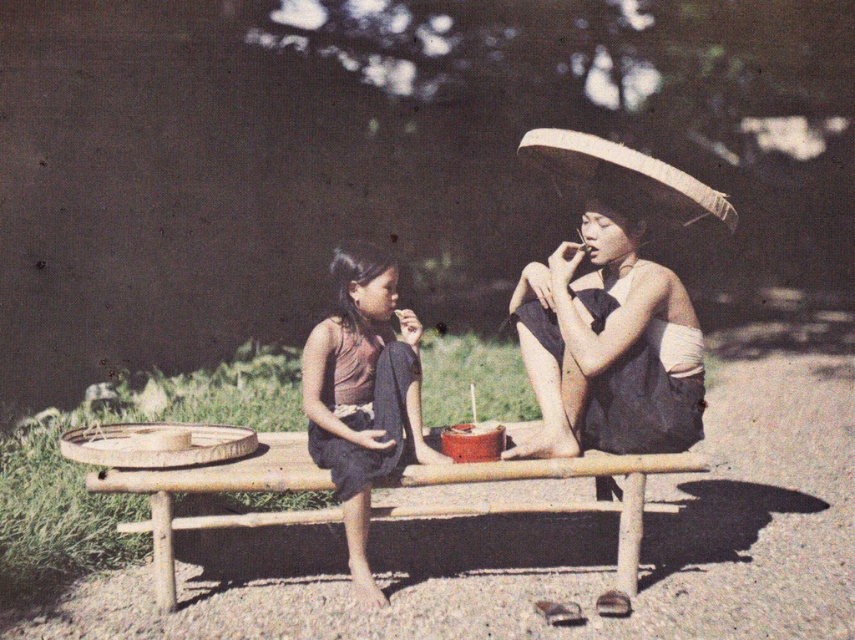
Is matte black dress at right positioned at the back of wooden picnic table at center?

Yes, matte black dress at right is behind wooden picnic table at center.

Measure the distance between matte black dress at right and wooden picnic table at center.

A distance of 52.23 centimeters exists between matte black dress at right and wooden picnic table at center.

Which is behind, point (596, 264) or point (618, 472)?

Positioned behind is point (596, 264).

At what (x,y) coordinates should I click in order to perform the action: click on matte black dress at right. Please return your answer as a coordinate pair (x, y). This screenshot has height=640, width=855. Looking at the image, I should click on (609, 340).

Which is in front, point (634, 552) or point (553, 148)?

Point (634, 552) is in front.

Does point (174, 484) come closer to viewer compared to point (722, 220)?

Yes, point (174, 484) is in front of point (722, 220).

At what (x,y) coordinates should I click in order to perform the action: click on wooden picnic table at center. Please return your answer as a coordinate pair (x, y). The image size is (855, 640). Looking at the image, I should click on (217, 492).

Locate an element on the screen. The width and height of the screenshot is (855, 640). wooden picnic table at center is located at coordinates (217, 492).

Is wooden picnic table at center to the right of brown matte dress at center from the viewer's perspective?

Yes, wooden picnic table at center is to the right of brown matte dress at center.

Who is more distant from viewer, (264, 444) or (413, 401)?

The point (264, 444) is more distant.

The image size is (855, 640). What are the coordinates of `wooden picnic table at center` in the screenshot? It's located at (217, 492).